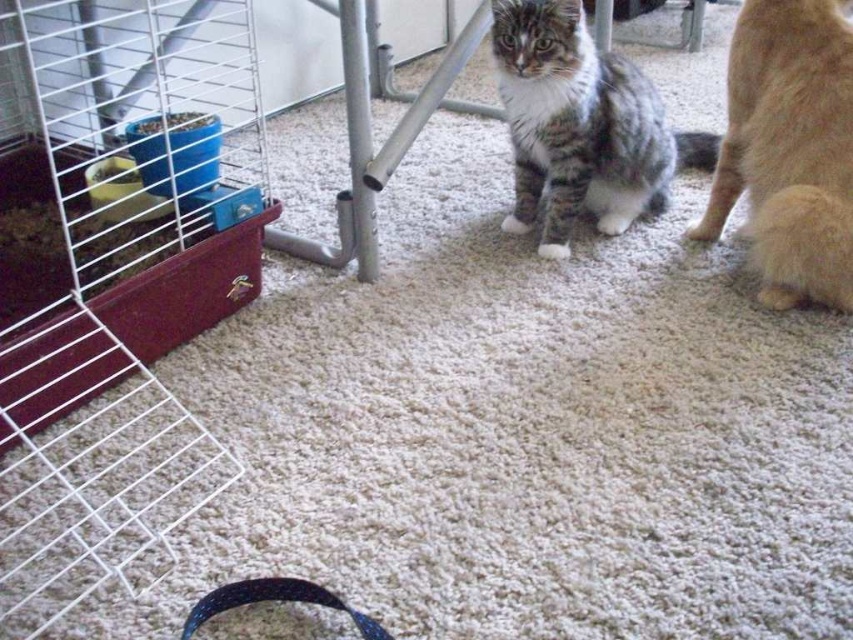
Question: Does fluffy orange cat at lower right have a greater width compared to tabby fur cat at center?

Choices:
 (A) no
 (B) yes

Answer: (A)

Question: Which object appears farthest from the camera in this image?

Choices:
 (A) tabby fur cat at center
 (B) fluffy orange cat at lower right

Answer: (A)

Question: Among these objects, which one is farthest from the camera?

Choices:
 (A) fluffy orange cat at lower right
 (B) tabby fur cat at center

Answer: (B)

Question: Does fluffy orange cat at lower right have a larger size compared to tabby fur cat at center?

Choices:
 (A) yes
 (B) no

Answer: (B)

Question: Does fluffy orange cat at lower right appear over tabby fur cat at center?

Choices:
 (A) yes
 (B) no

Answer: (B)